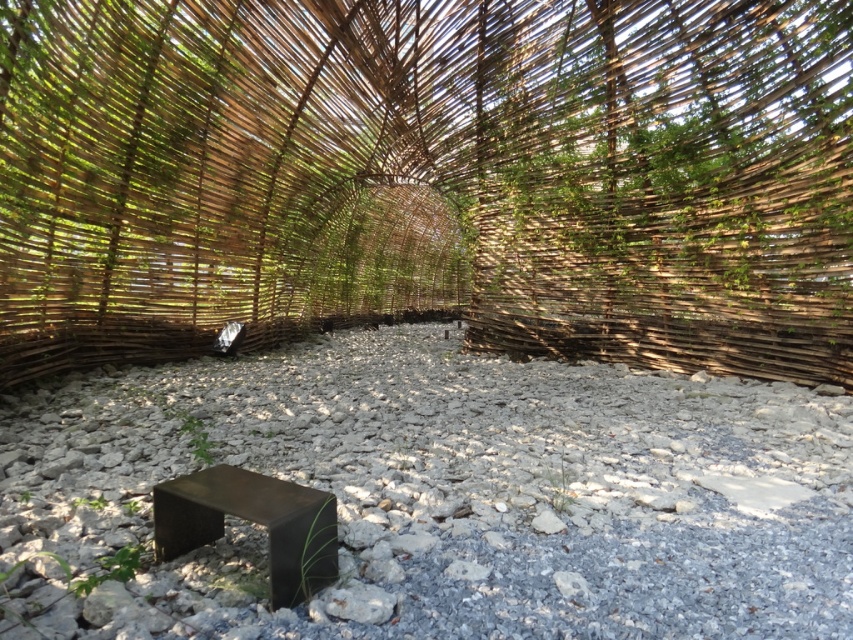
You are planning to place a small potted plant in the center of the gray gravel at center. However, you must ensure that the brown woven structure at center does not block sunlight from reaching the plant. Can you determine if the plant will receive enough sunlight in this location?

The brown woven structure at center is larger in size than gray gravel at center. Since the structure is larger, it may cast a shadow over the gray gravel at center, potentially blocking sunlight from reaching the plant. Therefore, the plant might not receive enough sunlight in this location.

You are standing at the entrance of the brown woven structure at center. If you walk straight ahead, will you immediately encounter the bench or the stones first?

The brown woven structure at center is located at point [428,177], so walking straight ahead from the entrance would first encounter the stones before reaching the bench.